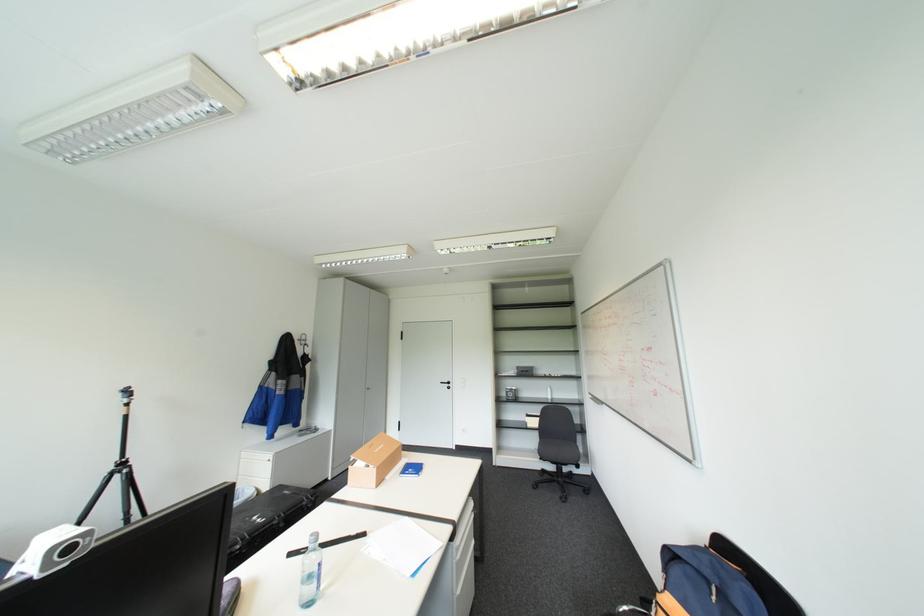
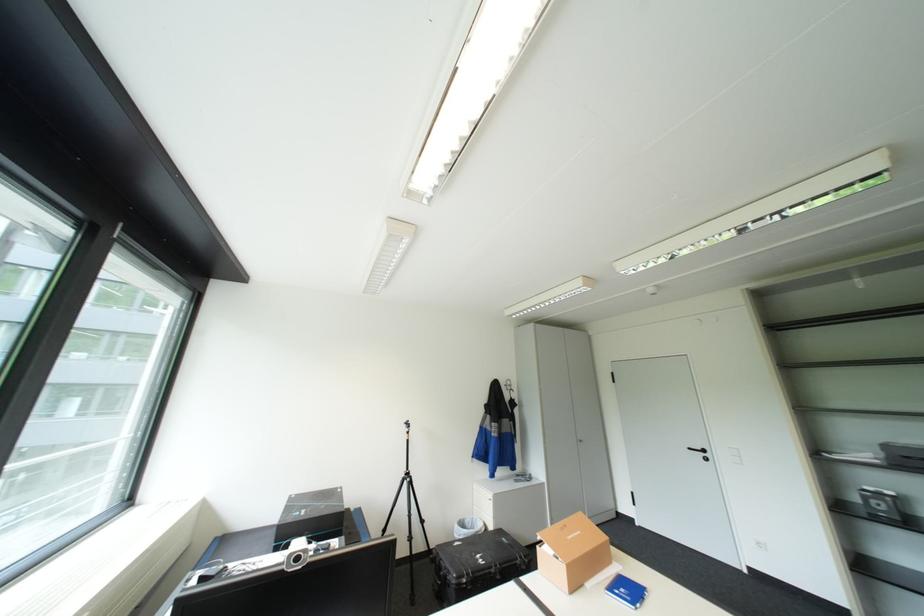
Find the pixel in the second image that matches pixel 294 490 in the first image.

(513, 538)